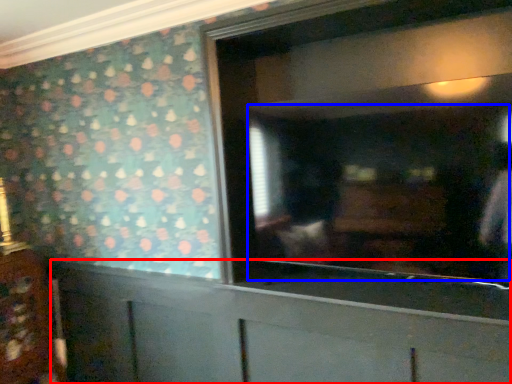
Question: Which object is closer to the camera taking this photo, cabinetry (highlighted by a red box) or mirror (highlighted by a blue box)?

Choices:
 (A) cabinetry
 (B) mirror

Answer: (B)